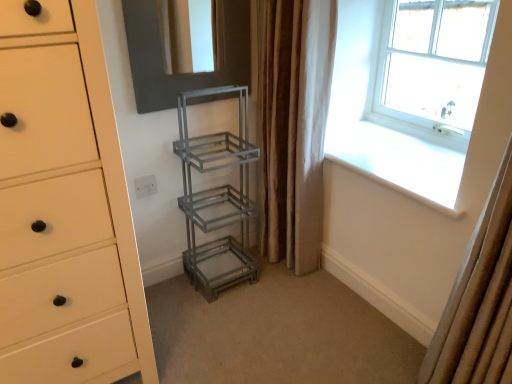
Question: Can you confirm if beige fabric curtain at right, which is the 2th curtain from back to front, is positioned to the right of clear glass window at upper right?

Choices:
 (A) yes
 (B) no

Answer: (B)

Question: Is beige fabric curtain at right, which is the first curtain from right to left, positioned before clear glass window at upper right?

Choices:
 (A) no
 (B) yes

Answer: (B)

Question: Can you confirm if beige fabric curtain at right, the 2th curtain positioned from the left, is taller than clear glass window at upper right?

Choices:
 (A) yes
 (B) no

Answer: (A)

Question: From the image's perspective, is beige fabric curtain at right, the 2th curtain positioned from the left, above clear glass window at upper right?

Choices:
 (A) yes
 (B) no

Answer: (B)

Question: Is beige fabric curtain at right, which is the 2th curtain from back to front, completely or partially outside of clear glass window at upper right?

Choices:
 (A) no
 (B) yes

Answer: (B)

Question: Could clear glass window at upper right be considered to be inside beige fabric curtain at right, the 2th curtain positioned from the left?

Choices:
 (A) yes
 (B) no

Answer: (B)

Question: Could you tell me if metallic gray shelf at center is turned towards metallic gray shelving unit at center?

Choices:
 (A) no
 (B) yes

Answer: (B)

Question: From a real-world perspective, does metallic gray shelf at center stand above metallic gray shelving unit at center?

Choices:
 (A) no
 (B) yes

Answer: (B)

Question: Is metallic gray shelf at center to the left of metallic gray shelving unit at center from the viewer's perspective?

Choices:
 (A) no
 (B) yes

Answer: (B)

Question: Can metallic gray shelving unit at center be found inside metallic gray shelf at center?

Choices:
 (A) yes
 (B) no

Answer: (B)

Question: Is metallic gray shelf at center thinner than metallic gray shelving unit at center?

Choices:
 (A) no
 (B) yes

Answer: (B)

Question: Is metallic gray shelf at center in front of metallic gray shelving unit at center?

Choices:
 (A) yes
 (B) no

Answer: (B)

Question: Is clear glass window at upper right closer to camera compared to matte white chest of drawers at left?

Choices:
 (A) no
 (B) yes

Answer: (A)